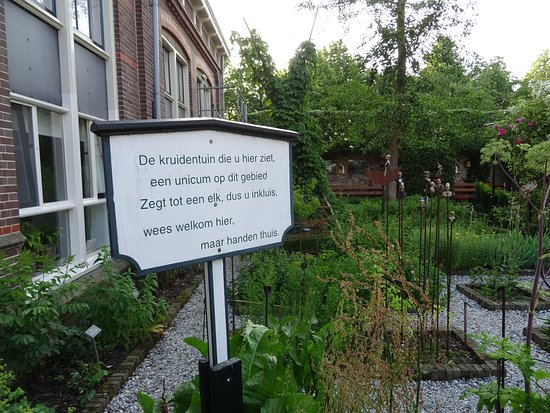
Where is `plant`? This screenshot has width=550, height=413. plant is located at coordinates (140, 312).